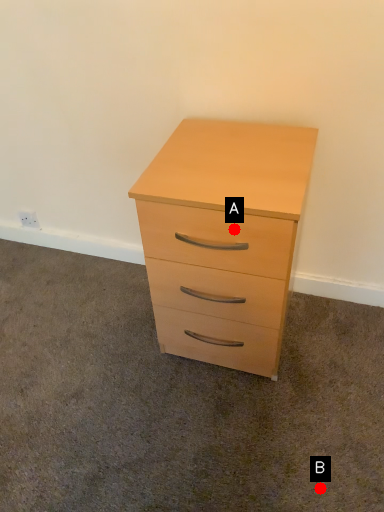
Question: Two points are circled on the image, labeled by A and B beside each circle. Which of the following is the closest to the observer?

Choices:
 (A) A is closer
 (B) B is closer

Answer: (A)